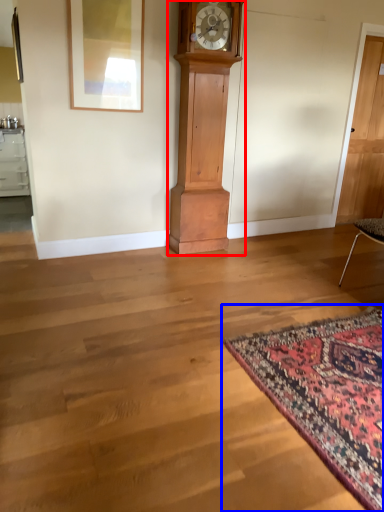
Question: Which of the following is the farthest to the observer, furniture (highlighted by a red box) or mat (highlighted by a blue box)?

Choices:
 (A) furniture
 (B) mat

Answer: (A)